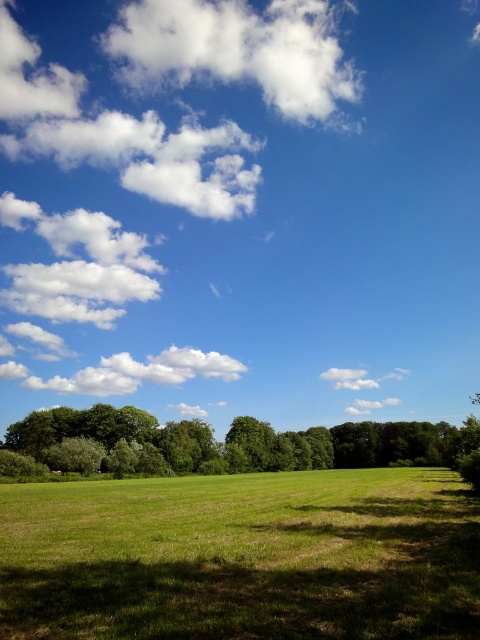
You are standing in the middle of a grassy field and looking up at the sky. You see the blue sky at upper center and the white fluffy cloud at upper center. Which one is located to the right of the other?

The blue sky at upper center is positioned on the right side of the white fluffy cloud at upper center.

You are standing in the middle of a green grass field and looking straight ahead. Where is the blue sky at upper center located in terms of direction and elevation?

The blue sky at upper center is located at point coordinates of 0.323 in the horizontal direction and 0.502 in the vertical elevation from your viewpoint.